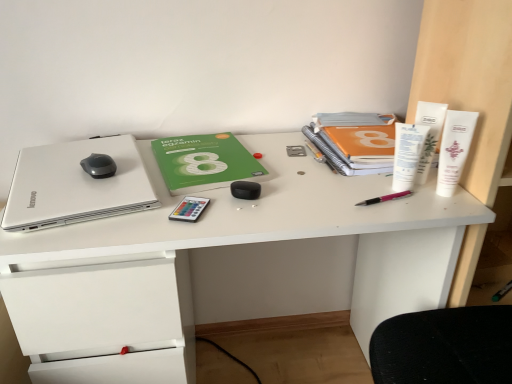
Locate an element on the screen. The image size is (512, 384). vacant space to the left of white plastic tube at upper right, placed as the first stationery when sorted from right to left is located at coordinates (364, 193).